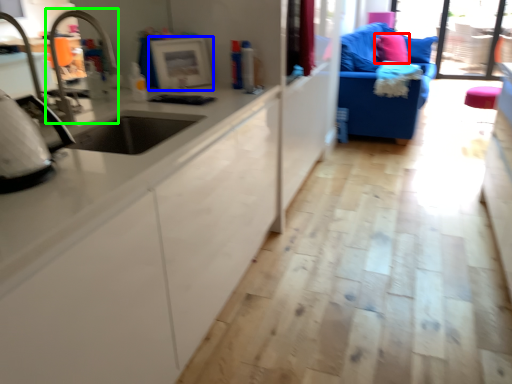
Question: Considering the real-world distances, which object is closest to pillow (highlighted by a red box)? appliance (highlighted by a blue box) or faucet (highlighted by a green box).

Choices:
 (A) appliance
 (B) faucet

Answer: (A)